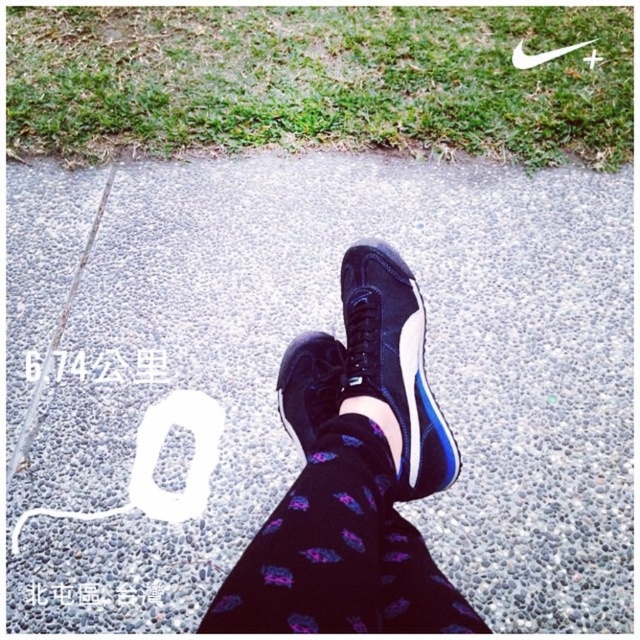
Question: Does matte black sneakers at center appear on the left side of black leather sneaker at center?

Choices:
 (A) no
 (B) yes

Answer: (A)

Question: Does black rubber pavement at center have a lesser width compared to matte black sneakers at center?

Choices:
 (A) no
 (B) yes

Answer: (A)

Question: Which of the following is the closest to the observer?

Choices:
 (A) (432, 438)
 (B) (349, 480)

Answer: (B)

Question: Considering the real-world distances, which object is farthest from the black leather sneaker at center?

Choices:
 (A) matte black sneakers at center
 (B) black rubber pavement at center

Answer: (B)

Question: Which point is farther from the camera taking this photo?

Choices:
 (A) (476, 522)
 (B) (420, 435)

Answer: (A)

Question: Can you confirm if black rubber pavement at center is positioned below black leather sneaker at center?

Choices:
 (A) yes
 (B) no

Answer: (B)